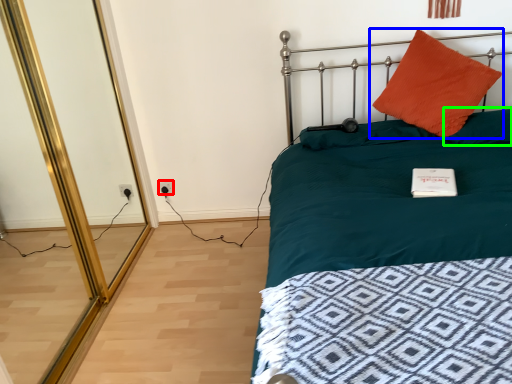
Question: Based on their relative distances, which object is nearer to electric outlet (highlighted by a red box)? Choose from pillow (highlighted by a blue box) and pillow (highlighted by a green box).

Choices:
 (A) pillow
 (B) pillow

Answer: (A)